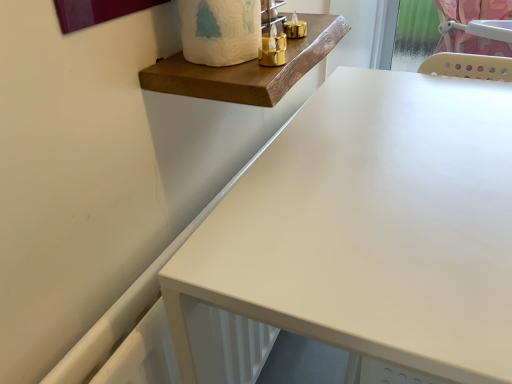
Question: Can you confirm if matte white table at center is shorter than white matte toilet paper at upper center?

Choices:
 (A) no
 (B) yes

Answer: (A)

Question: From a real-world perspective, does matte white table at center stand above white matte toilet paper at upper center?

Choices:
 (A) no
 (B) yes

Answer: (A)

Question: Considering the relative positions of matte white table at center and white matte toilet paper at upper center in the image provided, is matte white table at center to the left of white matte toilet paper at upper center from the viewer's perspective?

Choices:
 (A) no
 (B) yes

Answer: (A)

Question: Considering the relative sizes of matte white table at center and white matte toilet paper at upper center in the image provided, is matte white table at center smaller than white matte toilet paper at upper center?

Choices:
 (A) no
 (B) yes

Answer: (A)

Question: Is matte white table at center closer to camera compared to white matte toilet paper at upper center?

Choices:
 (A) yes
 (B) no

Answer: (A)

Question: Relative to wooden plank at upper center, is matte white table at center in front or behind?

Choices:
 (A) behind
 (B) front

Answer: (B)

Question: Is matte white table at center to the left or to the right of wooden plank at upper center in the image?

Choices:
 (A) right
 (B) left

Answer: (A)

Question: From their relative heights in the image, would you say matte white table at center is taller or shorter than wooden plank at upper center?

Choices:
 (A) short
 (B) tall

Answer: (B)

Question: From a real-world perspective, is matte white table at center positioned above or below wooden plank at upper center?

Choices:
 (A) above
 (B) below

Answer: (B)

Question: In terms of size, does white matte toilet paper at upper center appear bigger or smaller than matte white table at center?

Choices:
 (A) big
 (B) small

Answer: (B)

Question: Is white matte toilet paper at upper center inside the boundaries of matte white table at center, or outside?

Choices:
 (A) inside
 (B) outside

Answer: (B)

Question: From the image's perspective, is white matte toilet paper at upper center positioned above or below matte white table at center?

Choices:
 (A) below
 (B) above

Answer: (B)

Question: Based on their positions, is white matte toilet paper at upper center located to the left or right of matte white table at center?

Choices:
 (A) right
 (B) left

Answer: (B)

Question: From a real-world perspective, relative to wooden plank at upper center, is white matte toilet paper at upper center vertically above or below?

Choices:
 (A) below
 (B) above

Answer: (B)

Question: Is white matte toilet paper at upper center in front of or behind wooden plank at upper center in the image?

Choices:
 (A) front
 (B) behind

Answer: (A)